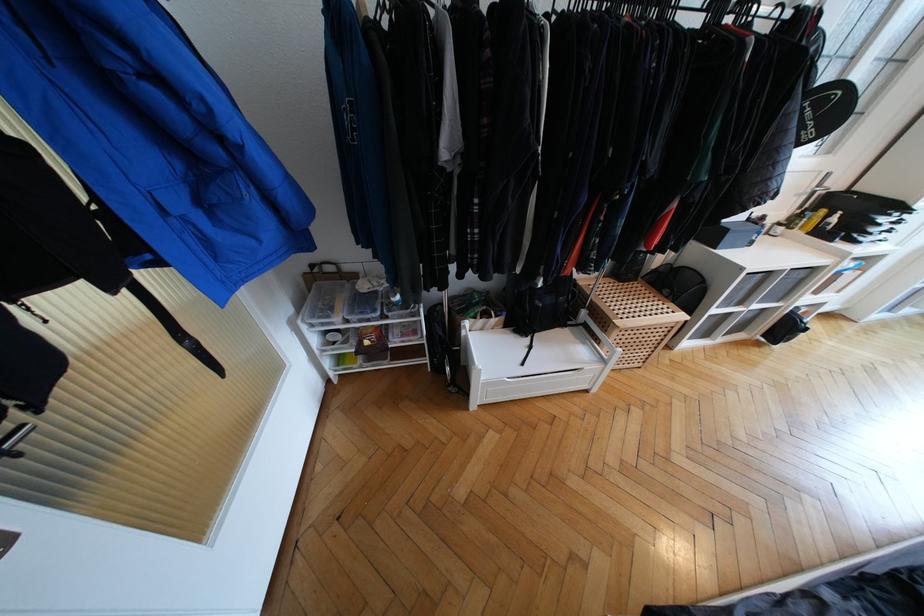
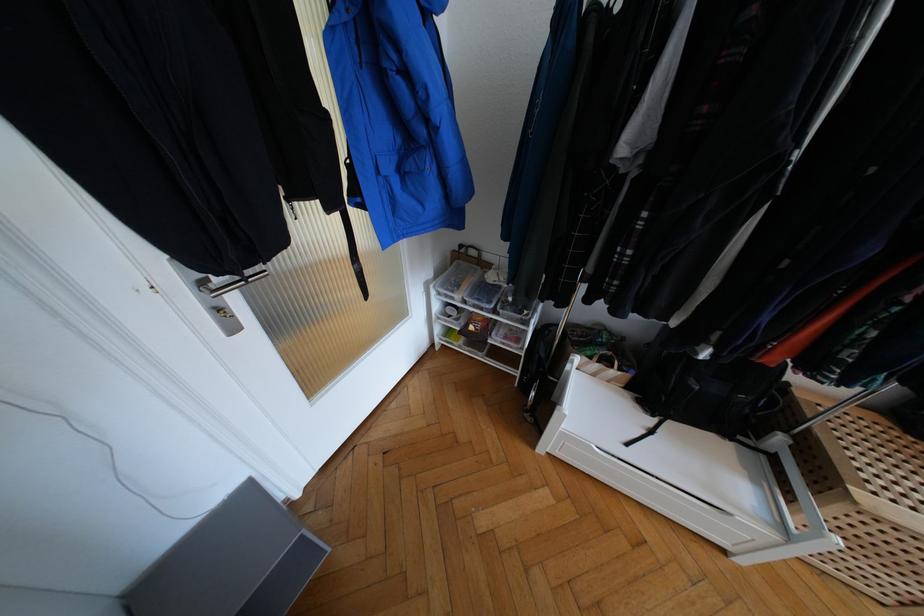
Question: The images are taken continuously from a first-person perspective. In which direction is your viewpoint rotating?

Choices:
 (A) Left
 (B) Right
 (C) Up
 (D) Down

Answer: (A)